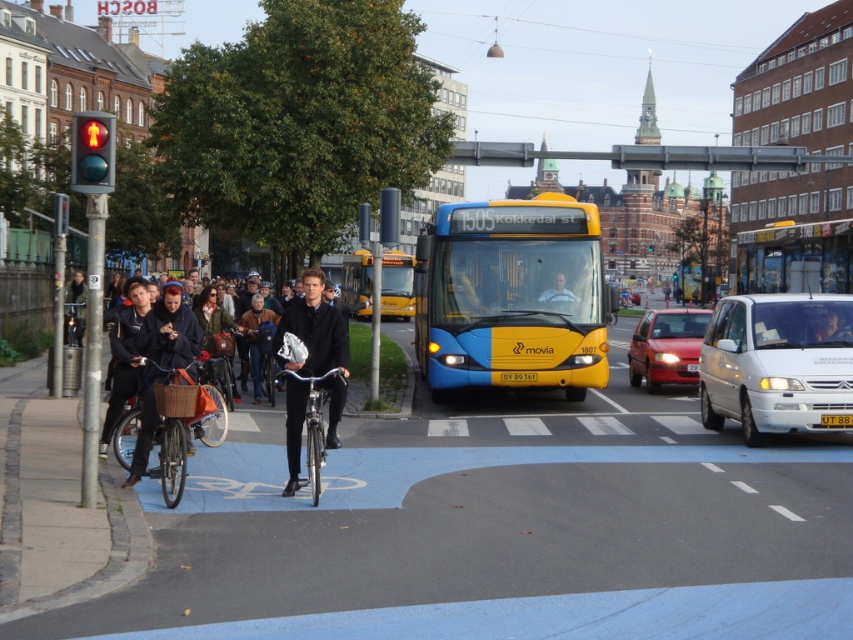
You are a delivery person on a bicycle and need to pass through the pedestrian crossing. There is a shiny red sedan at center and a red glass pedestrian signal at left in your path. Which object is narrower so you can safely navigate around it?

The shiny red sedan at center is thinner than the red glass pedestrian signal at left, so you can safely navigate around the shiny red sedan at center.

You are a delivery person on the silver metallic bicycle at center. You need to deliver a package to a location across the street. The shiny red sedan at center is blocking your path. Can you safely pass around the sedan without moving out of the street? Explain why based on their sizes.

The shiny red sedan at center is taller than silver metallic bicycle at center. Since the sedan is taller, it likely has a larger overall size, making it harder to maneuver around within the street. However, the bicycle is smaller in size, so you can safely pass around the sedan by moving closer to the edge of the street while staying within your lane, ensuring there is enough space to navigate around the vehicle without obstruction.

You are a delivery person who needs to park your silver metallic bicycle at center near the white matte van at right. Is there enough vertical space between the bicycle and the van to park without touching it?

The white matte van at right is above the silver metallic bicycle at center, so there is sufficient vertical clearance for parking the bicycle without touching the van.